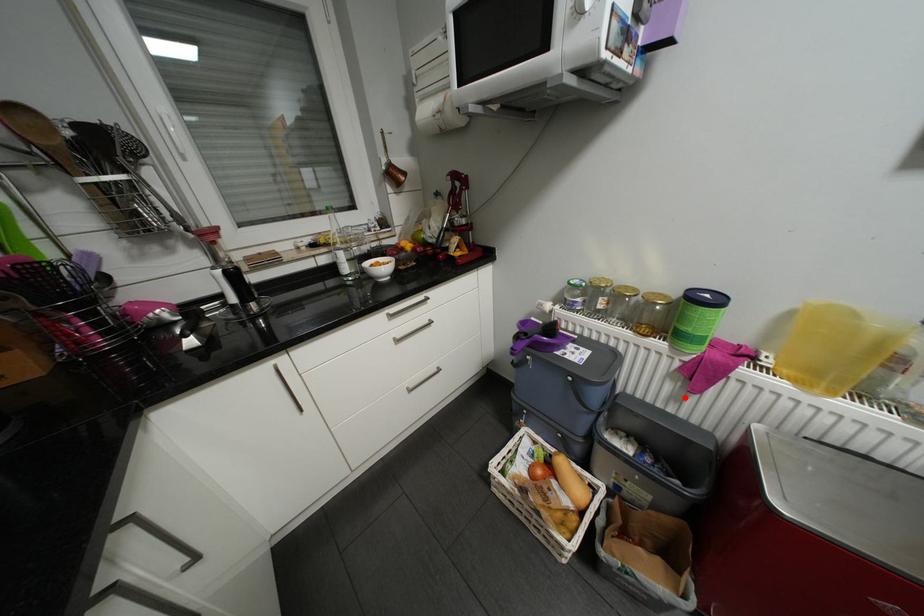
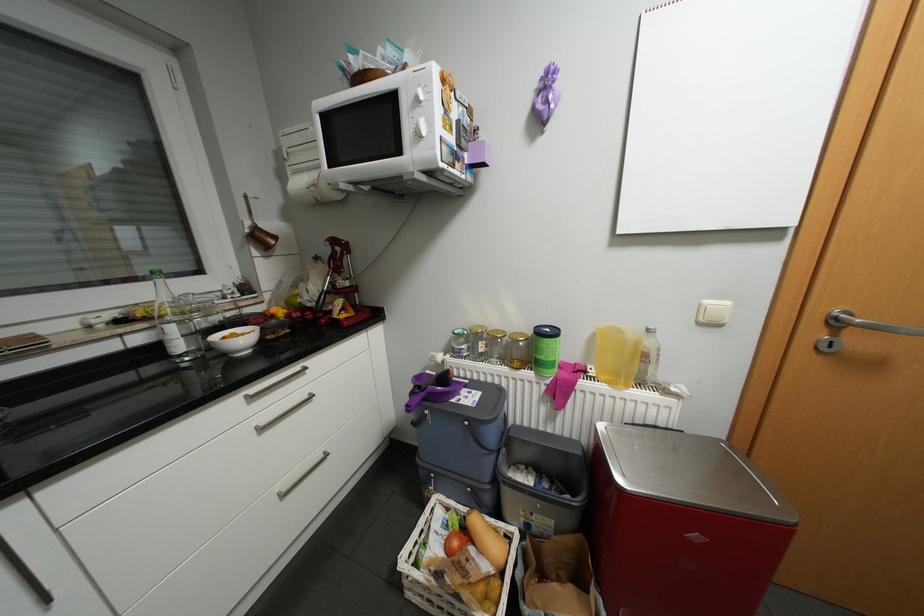
The point at the highlighted location is marked in the first image. Where is the corresponding point in the second image?

(558, 416)